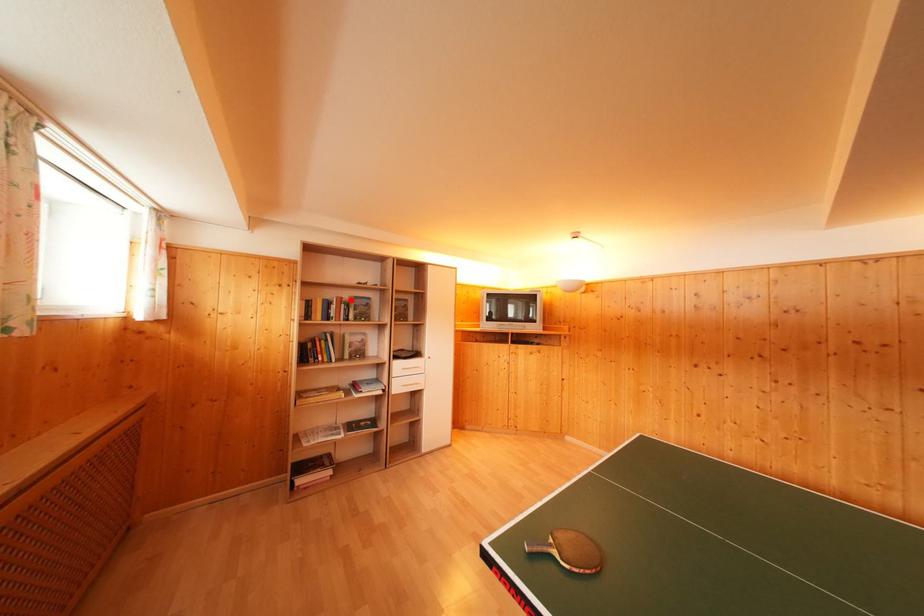
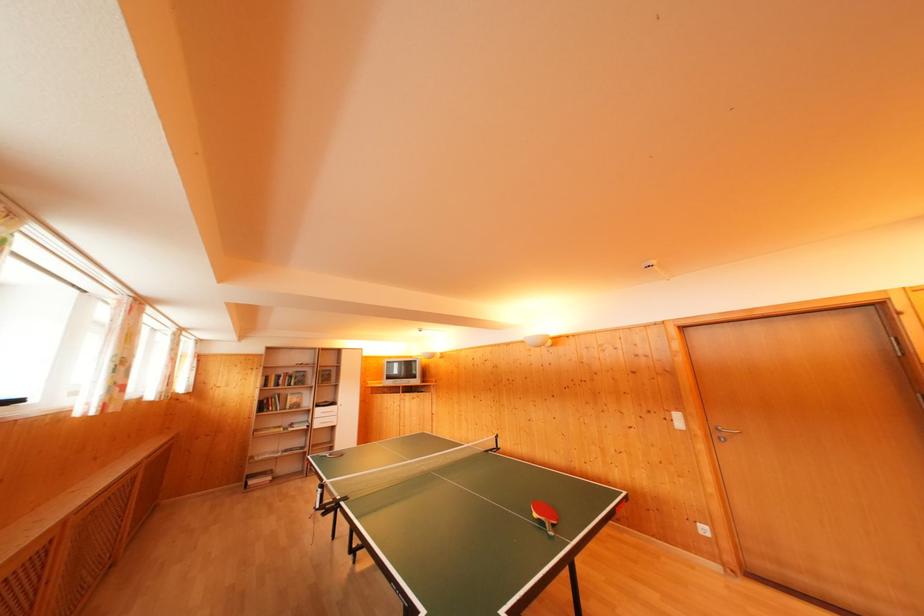
In the second image, find the point that corresponds to the highlighted location in the first image.

(296, 376)